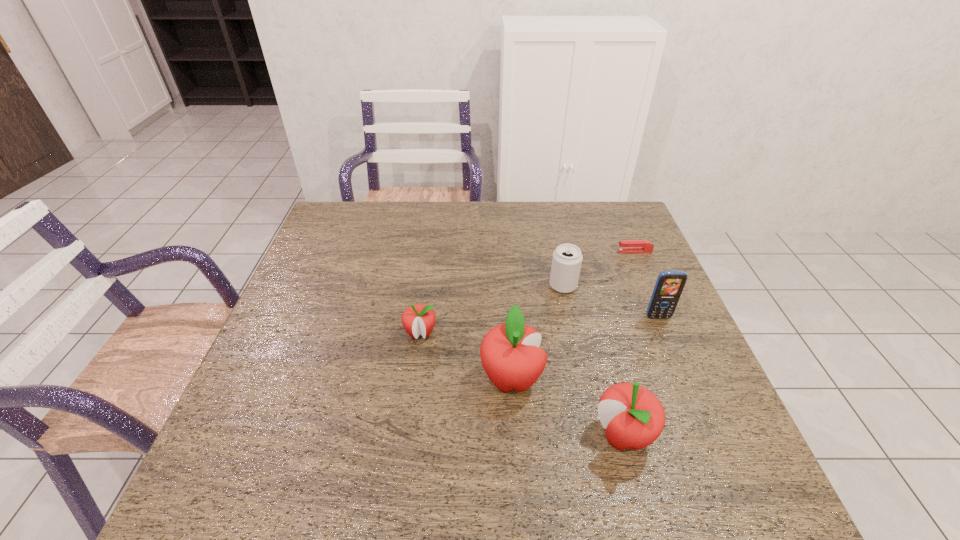
The apples are evenly distributed in the image. To maintain this, where would you place another apple on the left? Please point to a free space. Please provide its 2D coordinates. Your answer should be formatted as a tuple, i.e. [(x, y)], where the tuple contains the x and y coordinates of a point satisfying the conditions above.

[(346, 295)]